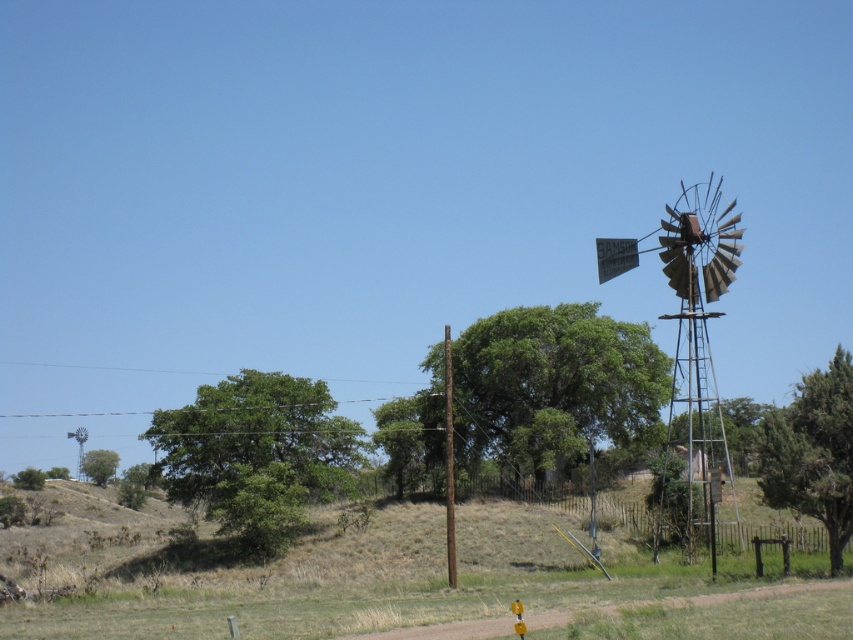
Does brown wooden pole at center have a greater width compared to rusty metal windmill at upper left?

In fact, brown wooden pole at center might be narrower than rusty metal windmill at upper left.

Is point (450, 582) behind point (80, 426)?

No.

Locate an element on the screen. brown wooden pole at center is located at coordinates (450, 461).

Which is more to the right, rusty metal windmill at right or rusty metal windmill at upper left?

rusty metal windmill at right

Is rusty metal windmill at right smaller than rusty metal windmill at upper left?

Incorrect, rusty metal windmill at right is not smaller in size than rusty metal windmill at upper left.

The width and height of the screenshot is (853, 640). I want to click on rusty metal windmill at right, so tap(689, 346).

The image size is (853, 640). Describe the element at coordinates (689, 346) in the screenshot. I see `rusty metal windmill at right` at that location.

This screenshot has height=640, width=853. What do you see at coordinates (689, 346) in the screenshot?
I see `rusty metal windmill at right` at bounding box center [689, 346].

I want to click on rusty metal windmill at right, so click(x=689, y=346).